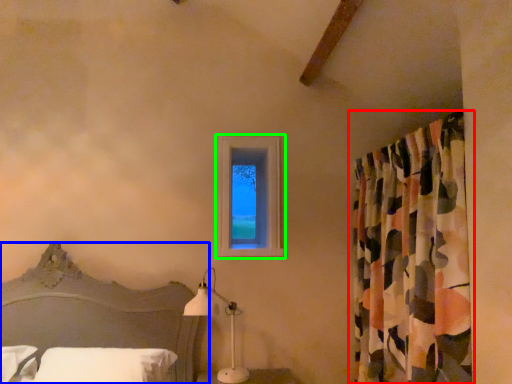
Question: Considering the real-world distances, which object is closest to curtain (highlighted by a red box)? bed (highlighted by a blue box) or window (highlighted by a green box).

Choices:
 (A) bed
 (B) window

Answer: (B)